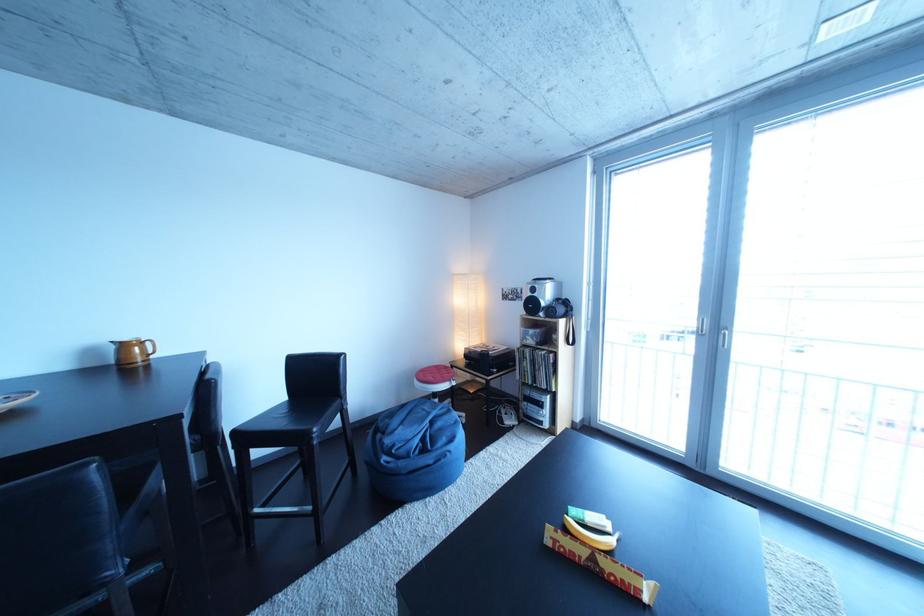
Image resolution: width=924 pixels, height=616 pixels. Describe the element at coordinates (599, 560) in the screenshot. I see `the Toblerone chocolate box` at that location.